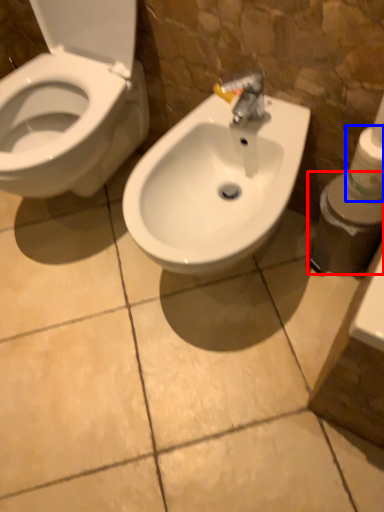
Question: Which point is closer to the camera, toiletries (highlighted by a red box) or toilet paper (highlighted by a blue box)?

Choices:
 (A) toiletries
 (B) toilet paper

Answer: (B)